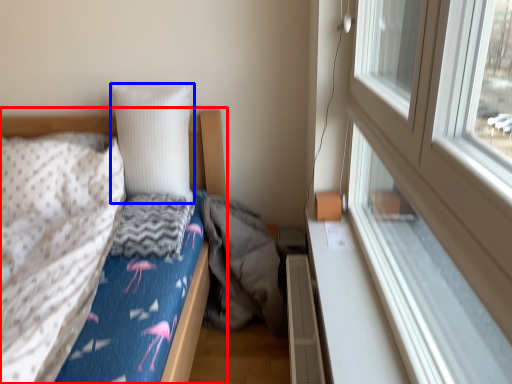
Question: Which of the following is the closest to the observer, bed (highlighted by a red box) or pillow (highlighted by a blue box)?

Choices:
 (A) bed
 (B) pillow

Answer: (A)